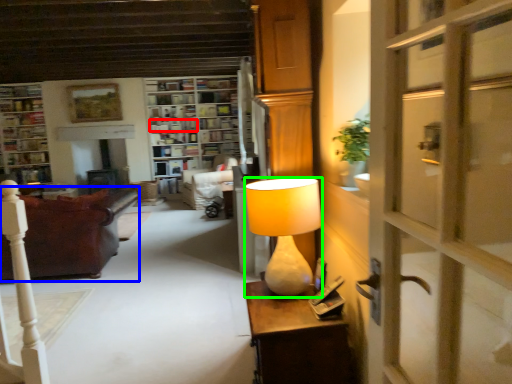
Question: Considering the real-world distances, which object is farthest from book (highlighted by a red box)? studio couch (highlighted by a blue box) or lamp (highlighted by a green box)?

Choices:
 (A) studio couch
 (B) lamp

Answer: (B)